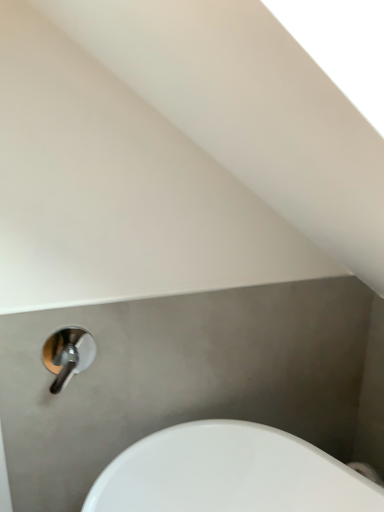
At what (x,y) coordinates should I click in order to perform the action: click on polished chrome tap at lower left. Please return your answer as a coordinate pair (x, y). The width and height of the screenshot is (384, 512). Looking at the image, I should click on (68, 355).

Describe the element at coordinates (68, 355) in the screenshot. I see `polished chrome tap at lower left` at that location.

Describe the element at coordinates (229, 473) in the screenshot. I see `white glossy sink at lower left` at that location.

Measure the distance between white glossy sink at lower left and camera.

The distance of white glossy sink at lower left from camera is 1.15 meters.

The height and width of the screenshot is (512, 384). I want to click on white glossy sink at lower left, so click(x=229, y=473).

The width and height of the screenshot is (384, 512). In order to click on polished chrome tap at lower left in this screenshot , I will do (68, 355).

Considering the relative positions of polished chrome tap at lower left and white glossy sink at lower left in the image provided, is polished chrome tap at lower left to the right of white glossy sink at lower left from the viewer's perspective?

No, polished chrome tap at lower left is not to the right of white glossy sink at lower left.

Which is behind, polished chrome tap at lower left or white glossy sink at lower left?

polished chrome tap at lower left is further away from the camera.

Is point (54, 380) in front of point (210, 449)?

Yes.

From the image's perspective, would you say polished chrome tap at lower left is positioned over white glossy sink at lower left?

Yes.

From a real-world perspective, is polished chrome tap at lower left physically below white glossy sink at lower left?

No, from a real-world perspective, polished chrome tap at lower left is not below white glossy sink at lower left.

Consider the image. Considering the sizes of objects polished chrome tap at lower left and white glossy sink at lower left in the image provided, who is thinner, polished chrome tap at lower left or white glossy sink at lower left?

polished chrome tap at lower left.

Which of these two, polished chrome tap at lower left or white glossy sink at lower left, stands shorter?

With less height is polished chrome tap at lower left.

Considering the relative sizes of polished chrome tap at lower left and white glossy sink at lower left in the image provided, is polished chrome tap at lower left bigger than white glossy sink at lower left?

No.

Is polished chrome tap at lower left completely or partially outside of white glossy sink at lower left?

Yes, polished chrome tap at lower left is not within white glossy sink at lower left.

Is polished chrome tap at lower left touching white glossy sink at lower left?

No, polished chrome tap at lower left is not making contact with white glossy sink at lower left.

Does polished chrome tap at lower left turn towards white glossy sink at lower left?

No, polished chrome tap at lower left is not aimed at white glossy sink at lower left.

Identify the location of sink on the right of polished chrome tap at lower left. This screenshot has height=512, width=384. (229, 473).

Is white glossy sink at lower left at the right side of polished chrome tap at lower left?

Indeed, white glossy sink at lower left is positioned on the right side of polished chrome tap at lower left.

Relative to polished chrome tap at lower left, is white glossy sink at lower left in front or behind?

In the image, white glossy sink at lower left appears in front of polished chrome tap at lower left.

Does point (262, 474) appear closer or farther from the camera than point (62, 374)?

Point (262, 474) is farther from the camera than point (62, 374).

From the image's perspective, is white glossy sink at lower left beneath polished chrome tap at lower left?

Indeed, from the image's perspective, white glossy sink at lower left is shown beneath polished chrome tap at lower left.

From a real-world perspective, is white glossy sink at lower left physically located above or below polished chrome tap at lower left?

Clearly, from a real-world perspective, white glossy sink at lower left is below polished chrome tap at lower left.

Looking at this image, can you confirm if white glossy sink at lower left is thinner than polished chrome tap at lower left?

Incorrect, the width of white glossy sink at lower left is not less than that of polished chrome tap at lower left.

Looking at this image, considering the sizes of objects white glossy sink at lower left and polished chrome tap at lower left in the image provided, who is taller, white glossy sink at lower left or polished chrome tap at lower left?

white glossy sink at lower left is taller.

Considering the sizes of objects white glossy sink at lower left and polished chrome tap at lower left in the image provided, who is smaller, white glossy sink at lower left or polished chrome tap at lower left?

polished chrome tap at lower left is smaller.

Looking at this image, which is correct: white glossy sink at lower left is inside polished chrome tap at lower left, or outside of it?

white glossy sink at lower left is not enclosed by polished chrome tap at lower left.

Is white glossy sink at lower left far from polished chrome tap at lower left?

No, white glossy sink at lower left is in close proximity to polished chrome tap at lower left.

Is white glossy sink at lower left oriented away from polished chrome tap at lower left?

white glossy sink at lower left is not turned away from polished chrome tap at lower left.

Can you tell me how much white glossy sink at lower left and polished chrome tap at lower left differ in facing direction?

66.2 degrees separate the facing orientations of white glossy sink at lower left and polished chrome tap at lower left.

Locate an element on the screen. This screenshot has height=512, width=384. tap that appears behind the white glossy sink at lower left is located at coordinates (68, 355).

Where is `sink in front of the polished chrome tap at lower left`? sink in front of the polished chrome tap at lower left is located at coordinates tap(229, 473).

The width and height of the screenshot is (384, 512). Identify the location of sink that appears below the polished chrome tap at lower left (from the image's perspective). (229, 473).